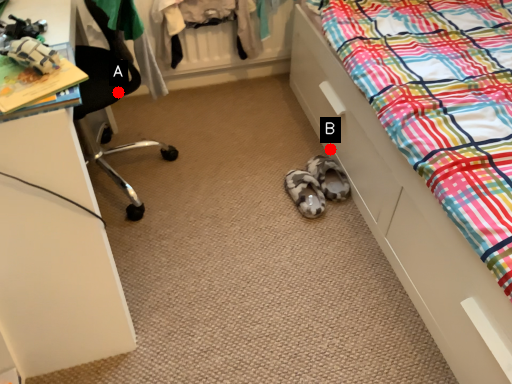
Question: Two points are circled on the image, labeled by A and B beside each circle. Which of the following is the closest to the observer?

Choices:
 (A) A is closer
 (B) B is closer

Answer: (A)